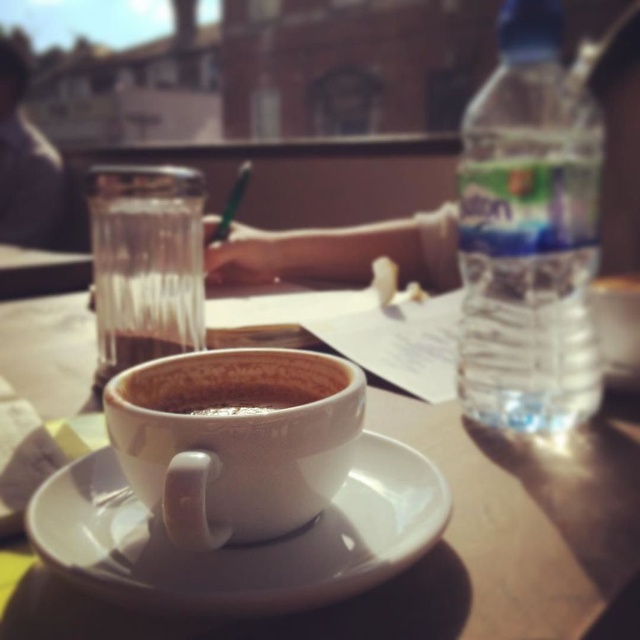
You are at a cozy cafe and want to place a 10 cm wide book between the white ceramic cup at center and the clear glass at center. Can the book fit between them?

The white ceramic cup at center is wider than the clear glass at center, but the exact distance between them isn

You are a barista who needs to place a small sugar cube between the white ceramic saucer at center and the white ceramic mug at center. Can you fit it there?

The distance between the white ceramic saucer at center and the white ceramic mug at center is 1.13 inches. Since a standard sugar cube is about 0.5 inches wide, there is enough space to place it between them.

You are a barista who needs to place a new cup on the table without moving the existing items. The white ceramic saucer at center and the white ceramic mug at center are already there. Where should you place the new cup so it doesn

The white ceramic saucer at center is positioned on the right side of white ceramic mug at center. Since the saucer is already to the right of the mug, placing the new cup to the left of the mug or to the left of the saucer would avoid overlapping existing items. However, considering typical table arrangements, placing it to the left of the mug might be more practical as it keeps the saucer and mug together.